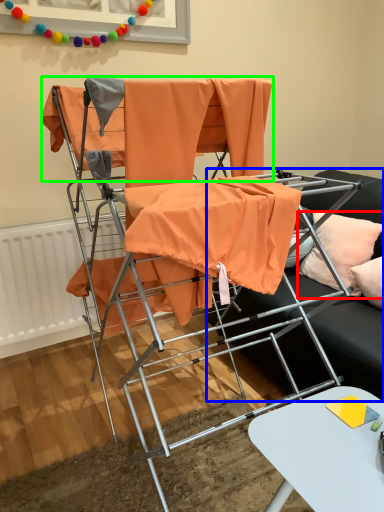
Question: Which is farther away from pillow (highlighted by a red box)? studio couch (highlighted by a blue box) or fabric (highlighted by a green box)?

Choices:
 (A) studio couch
 (B) fabric

Answer: (B)